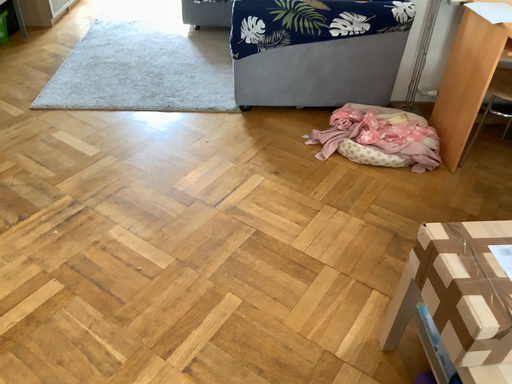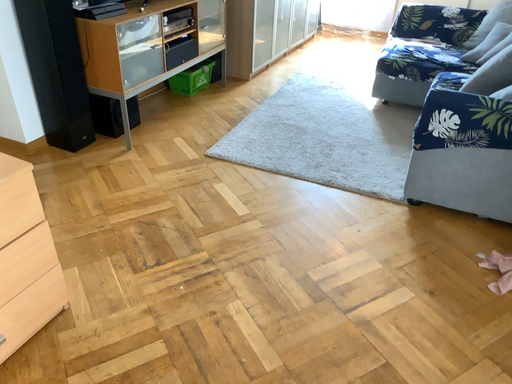
Question: Which way did the camera rotate in the video?

Choices:
 (A) rotated left
 (B) rotated right

Answer: (A)